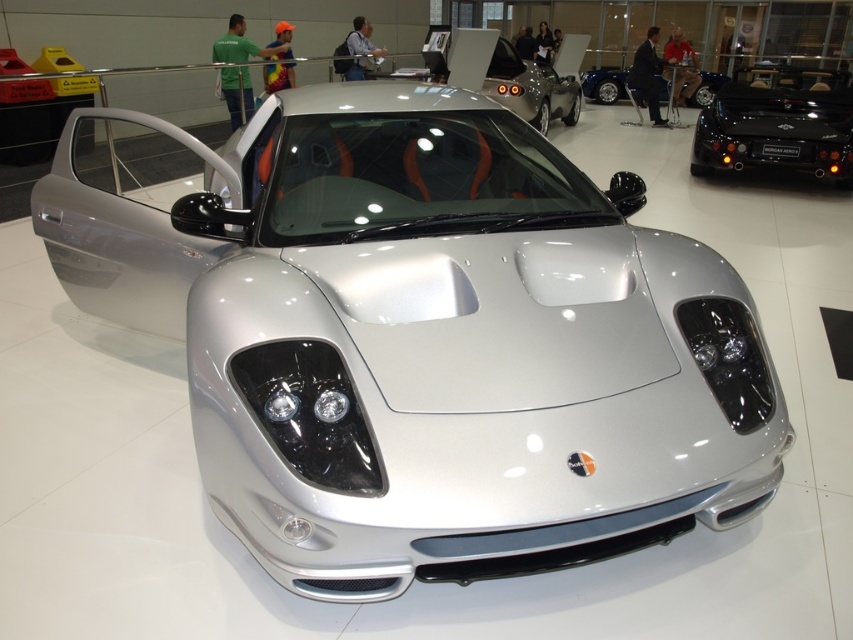
Can you confirm if black glossy morgan aero at right is positioned below silver metallic sports car at center?

Correct, black glossy morgan aero at right is located below silver metallic sports car at center.

Is black glossy morgan aero at right to the right of silver metallic sports car at center from the viewer's perspective?

Correct, you'll find black glossy morgan aero at right to the right of silver metallic sports car at center.

Between point (792, 125) and point (544, 83), which one is positioned in front?

Point (792, 125)

Where is `black glossy morgan aero at right`? Image resolution: width=853 pixels, height=640 pixels. black glossy morgan aero at right is located at coordinates (778, 122).

Does silver metallic sports car at center appear over glossy blue car at upper center?

Incorrect, silver metallic sports car at center is not positioned above glossy blue car at upper center.

Does silver metallic sports car at center lie behind glossy blue car at upper center?

No, silver metallic sports car at center is closer to the viewer.

Is point (538, 61) more distant than point (637, 99)?

No.

Find the location of a particular element. The width and height of the screenshot is (853, 640). silver metallic sports car at center is located at coordinates (531, 88).

Does silver metallic car at center appear on the right side of silver metallic sports car at center?

Incorrect, silver metallic car at center is not on the right side of silver metallic sports car at center.

Which is more to the left, silver metallic car at center or silver metallic sports car at center?

Positioned to the left is silver metallic car at center.

Which is in front, point (639, 456) or point (433, 42)?

Point (639, 456) is in front.

The height and width of the screenshot is (640, 853). In order to click on silver metallic car at center in this screenshot , I will do `click(428, 339)`.